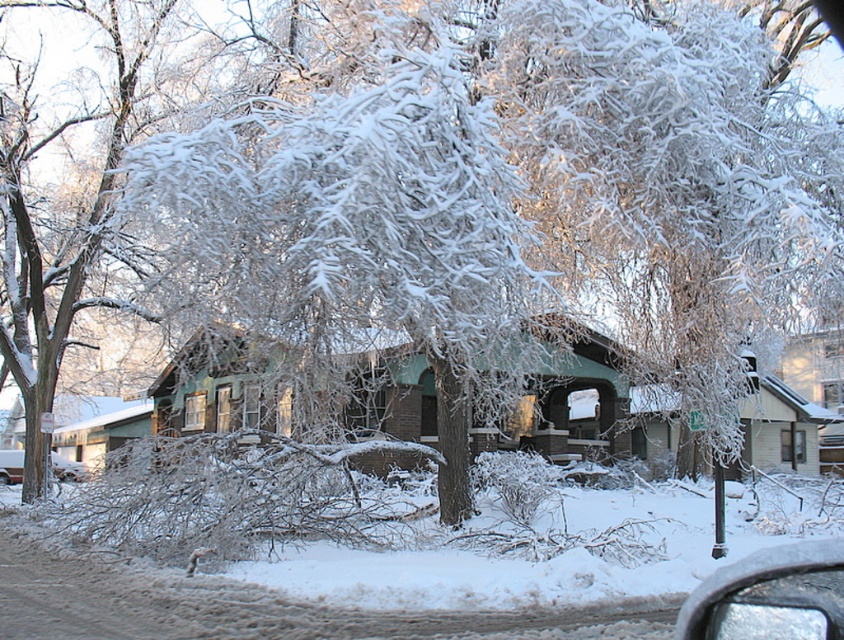
From the picture: Who is more forward, (717, 611) or (8, 477)?

Point (717, 611) is in front.

Does point (815, 595) come farther from viewer compared to point (62, 476)?

No, it is in front of (62, 476).

Is point (782, 627) farther from viewer compared to point (72, 474)?

That is False.

In order to click on clear glass mirror at lower right in this screenshot , I will do `click(771, 595)`.